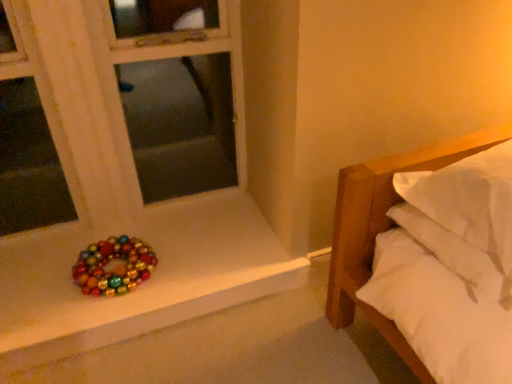
Question: Would you say multicolored baubles at lower left is part of white soft bed at right's contents?

Choices:
 (A) no
 (B) yes

Answer: (A)

Question: Is white soft bed at right completely or partially outside of multicolored baubles at lower left?

Choices:
 (A) yes
 (B) no

Answer: (A)

Question: Does white soft bed at right have a greater height compared to multicolored baubles at lower left?

Choices:
 (A) yes
 (B) no

Answer: (A)

Question: Is white soft bed at right at the left side of multicolored baubles at lower left?

Choices:
 (A) no
 (B) yes

Answer: (A)

Question: From a real-world perspective, is white soft bed at right positioned over multicolored baubles at lower left based on gravity?

Choices:
 (A) no
 (B) yes

Answer: (B)

Question: In the image, is white soft bed at right on the left side or the right side of multicolored baubles at lower left?

Choices:
 (A) left
 (B) right

Answer: (B)

Question: In terms of height, does white soft bed at right look taller or shorter compared to multicolored baubles at lower left?

Choices:
 (A) tall
 (B) short

Answer: (A)

Question: From a real-world perspective, is white soft bed at right positioned above or below multicolored baubles at lower left?

Choices:
 (A) below
 (B) above

Answer: (B)

Question: Considering the positions of white soft bed at right and multicolored baubles at lower left in the image, is white soft bed at right bigger or smaller than multicolored baubles at lower left?

Choices:
 (A) small
 (B) big

Answer: (B)

Question: From a real-world perspective, is multicolored baubles at lower left positioned above or below glossy multicolored beads at lower left?

Choices:
 (A) below
 (B) above

Answer: (A)

Question: Is multicolored baubles at lower left to the left or to the right of glossy multicolored beads at lower left in the image?

Choices:
 (A) left
 (B) right

Answer: (B)

Question: Is multicolored baubles at lower left wider or thinner than glossy multicolored beads at lower left?

Choices:
 (A) wide
 (B) thin

Answer: (A)

Question: Based on their sizes in the image, would you say multicolored baubles at lower left is bigger or smaller than glossy multicolored beads at lower left?

Choices:
 (A) big
 (B) small

Answer: (A)

Question: Considering the positions of glossy multicolored beads at lower left and white soft bed at right in the image, is glossy multicolored beads at lower left wider or thinner than white soft bed at right?

Choices:
 (A) thin
 (B) wide

Answer: (A)

Question: Is point (84, 291) positioned closer to the camera than point (377, 198)?

Choices:
 (A) closer
 (B) farther

Answer: (B)